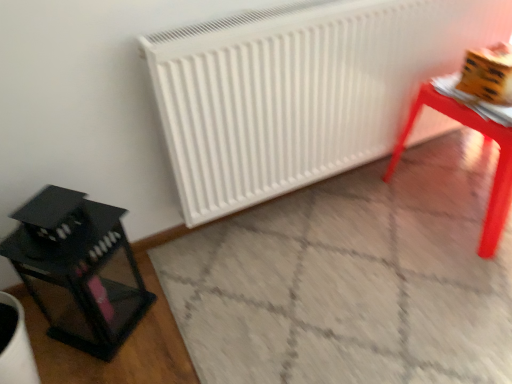
Find the location of a particular element. This screenshot has height=384, width=512. free space to the left of black glass lantern at left is located at coordinates (42, 314).